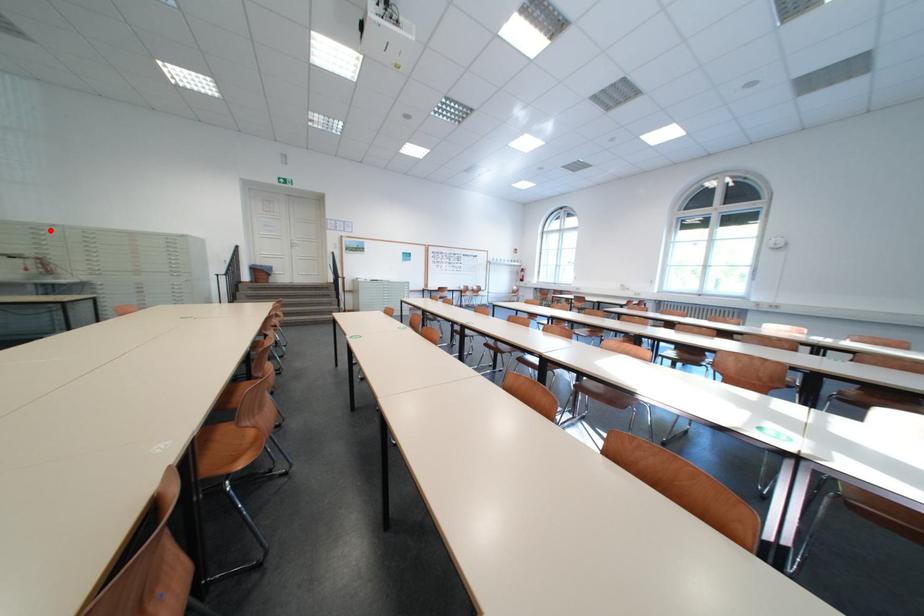
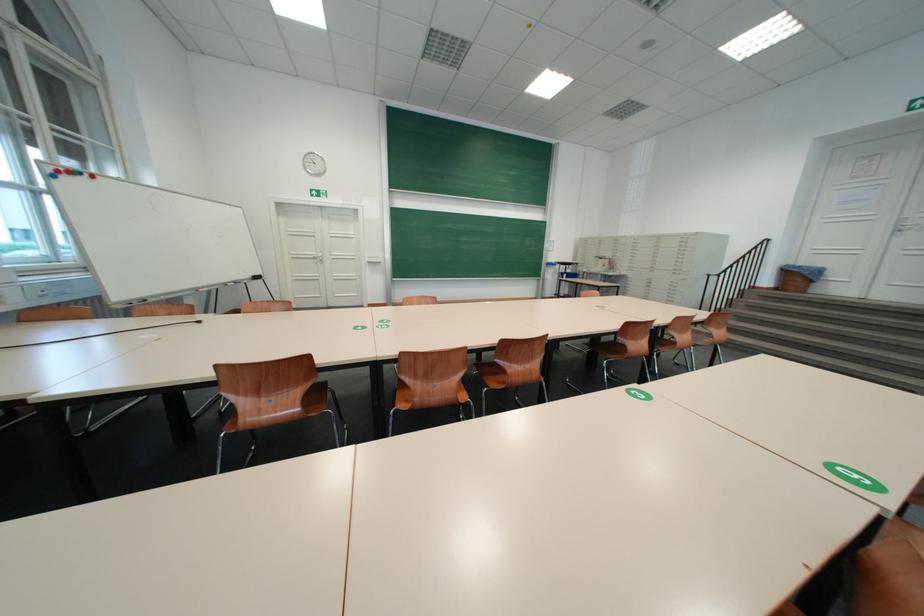
Find the pixel in the second image that matches the highlighted location in the first image.

(630, 241)